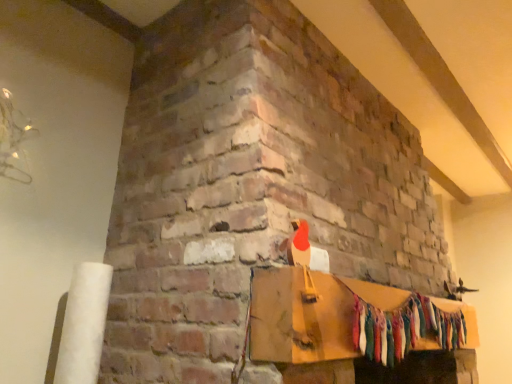
Question: Is wooden mantel at upper center positioned beyond the bounds of multicolored fabric garland at center?

Choices:
 (A) no
 (B) yes

Answer: (B)

Question: Is multicolored fabric garland at center a part of wooden mantel at upper center?

Choices:
 (A) no
 (B) yes

Answer: (A)

Question: Is wooden mantel at upper center thinner than multicolored fabric garland at center?

Choices:
 (A) yes
 (B) no

Answer: (B)

Question: Does wooden mantel at upper center appear on the left side of multicolored fabric garland at center?

Choices:
 (A) yes
 (B) no

Answer: (A)

Question: Can you confirm if wooden mantel at upper center is wider than multicolored fabric garland at center?

Choices:
 (A) no
 (B) yes

Answer: (B)

Question: Can you confirm if wooden mantel at upper center is smaller than multicolored fabric garland at center?

Choices:
 (A) no
 (B) yes

Answer: (A)

Question: Is the position of multicolored fabric garland at center less distant than that of wooden mantel at upper center?

Choices:
 (A) yes
 (B) no

Answer: (B)

Question: From a real-world perspective, is multicolored fabric garland at center beneath wooden mantel at upper center?

Choices:
 (A) yes
 (B) no

Answer: (A)

Question: Is multicolored fabric garland at center turned away from wooden mantel at upper center?

Choices:
 (A) yes
 (B) no

Answer: (A)

Question: Is wooden mantel at upper center surrounded by multicolored fabric garland at center?

Choices:
 (A) no
 (B) yes

Answer: (A)

Question: From a real-world perspective, is multicolored fabric garland at center positioned over wooden mantel at upper center based on gravity?

Choices:
 (A) yes
 (B) no

Answer: (B)

Question: Can you confirm if multicolored fabric garland at center is shorter than wooden mantel at upper center?

Choices:
 (A) yes
 (B) no

Answer: (B)

Question: Is multicolored fabric garland at center wider or thinner than wooden mantel at upper center?

Choices:
 (A) wide
 (B) thin

Answer: (B)